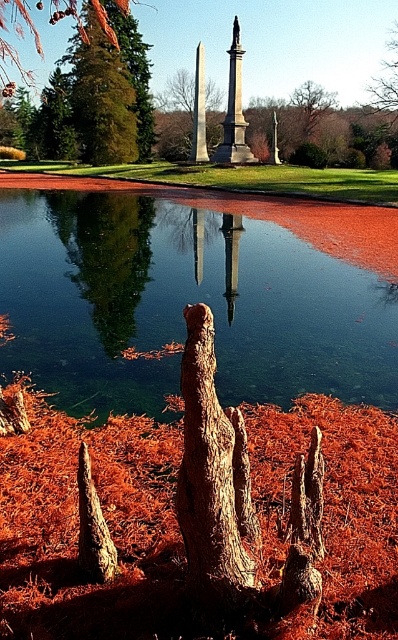
Question: Which object is the closest to the brown rough tree at center?

Choices:
 (A) rough bark tree trunk at center
 (B) clear water at center
 (C) green textured tree at upper left

Answer: (C)

Question: Does rough bark tree trunk at center appear under green textured tree at upper left?

Choices:
 (A) no
 (B) yes

Answer: (B)

Question: Is brown rough tree at center behind smooth gray stone obelisk at center?

Choices:
 (A) yes
 (B) no

Answer: (A)

Question: Considering the real-world distances, which object is farthest from the clear water at center?

Choices:
 (A) smooth gray stone obelisk at center
 (B) rough bark tree trunk at center
 (C) brown rough tree at center
 (D) green textured tree at upper left

Answer: (C)

Question: Can you confirm if clear water at center is bigger than brown rough tree at center?

Choices:
 (A) no
 (B) yes

Answer: (A)

Question: Based on their relative distances, which object is nearer to the smooth gray stone obelisk at center?

Choices:
 (A) clear water at center
 (B) brown rough tree at center

Answer: (B)